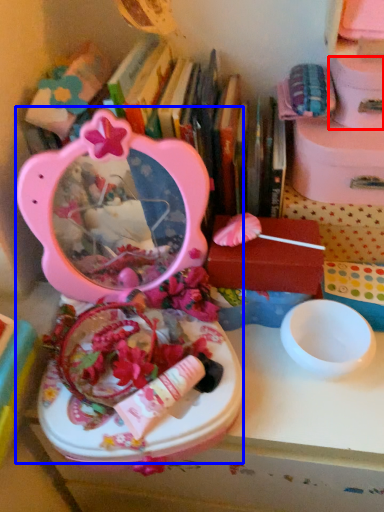
Question: Among these objects, which one is farthest to the camera, storage box (highlighted by a red box) or toy (highlighted by a blue box)?

Choices:
 (A) storage box
 (B) toy

Answer: (A)